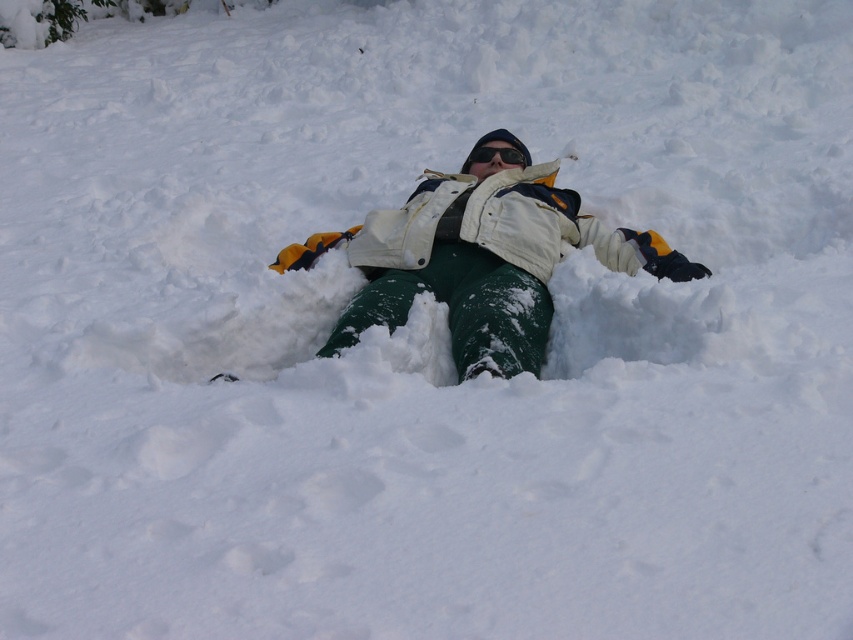
You are a photographer trying to capture the perfect shot of the person making a snow angel. You want to focus on the white fleece jacket at center while ensuring the snow angel pattern is still visible in the background. Based on the coordinates provided, where should you position your camera relative to the jacket to achieve this composition?

The white fleece jacket at center is located at coordinates point (x=480, y=259). To capture the jacket while keeping the snow angel pattern visible in the background, position the camera slightly above and to the side of the jacket so the arms and legs of the snow angel remain in view.

In the scene shown: You are a photographer trying to capture the snow angel scene. You need to focus on the white fleece jacket at center and the black reflective goggles at center. Which object should you adjust your focus to first if you want to ensure both are in sharp focus?

The white fleece jacket at center is in front of the black reflective goggles at center, so you should focus on the white fleece jacket at center first to ensure both are in sharp focus.

You are a photographer trying to capture the perfect shot of the person making a snow angel. You need to ensure that both the white fleece jacket at center and the black reflective goggles at center are clearly visible in the frame. Given their sizes, which object should you focus on first to ensure both are in focus?

The white fleece jacket at center has a greater height compared to the black reflective goggles at center, so focusing on the larger object first will help ensure both are in focus.